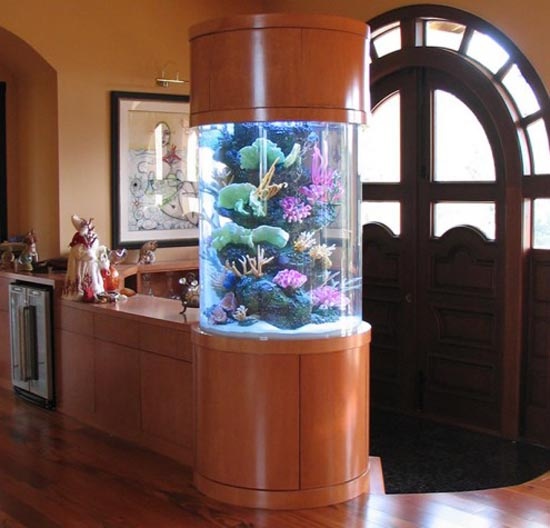
Identify the location of window. (478, 50).